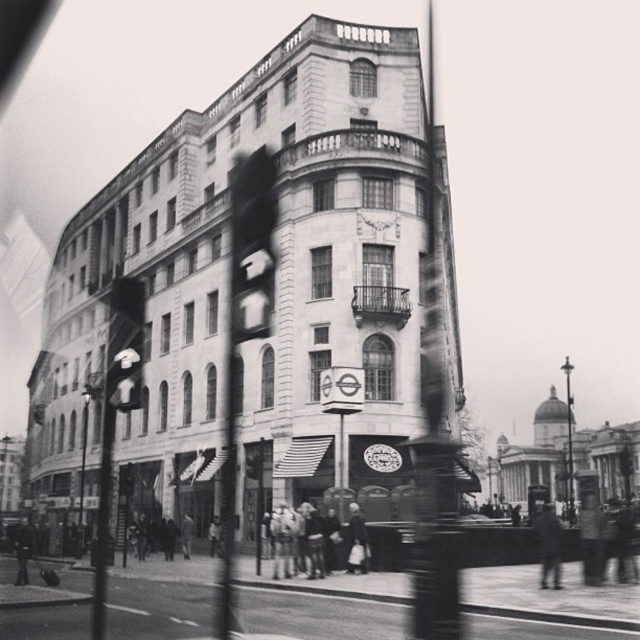
Question: Is metallic pole at lower left thinner than light beige fabric coat at center?

Choices:
 (A) yes
 (B) no

Answer: (B)

Question: Which point is closer to the camera?

Choices:
 (A) (552, 538)
 (B) (29, 547)
 (C) (83, 422)
 (D) (566, 433)

Answer: (A)

Question: Where is dark gray coat at center located in relation to metallic streetlight at right in the image?

Choices:
 (A) right
 (B) left

Answer: (B)

Question: Which of the following is the closest to the observer?

Choices:
 (A) dark gray coat at center
 (B) metallic pole at lower left

Answer: (A)

Question: Which is nearer to the dark gray coat at lower left?

Choices:
 (A) light beige fabric coat at center
 (B) metallic streetlight at right
 (C) dark gray coat at center

Answer: (A)

Question: From the image, what is the correct spatial relationship of dark gray coat at center in relation to metallic pole at lower left?

Choices:
 (A) below
 (B) above

Answer: (B)